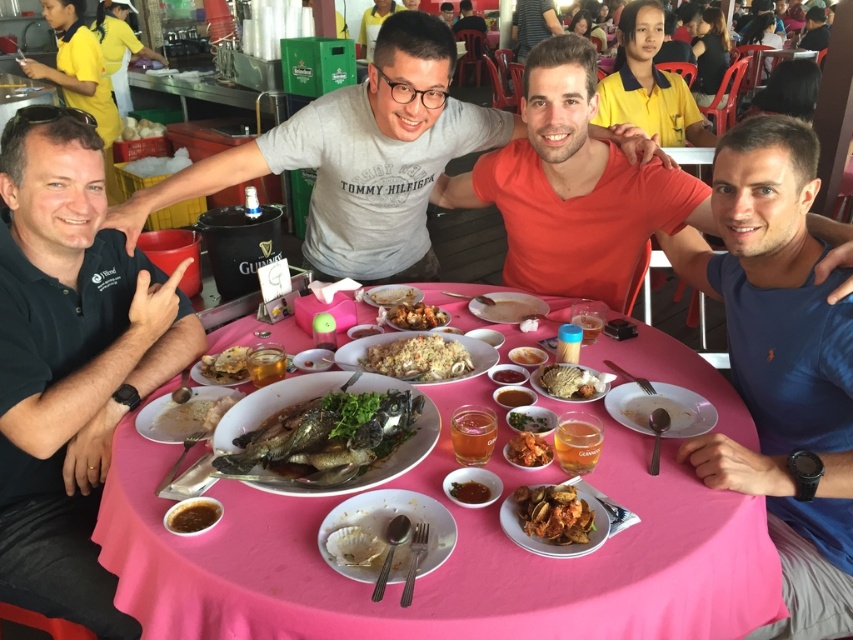
Can you confirm if gray cotton shirt at upper center is smaller than shiny orange shrimp at center?

No.

Is gray cotton shirt at upper center to the left of shiny orange shrimp at center from the viewer's perspective?

Yes, gray cotton shirt at upper center is to the left of shiny orange shrimp at center.

Find the location of `gray cotton shirt at upper center`. gray cotton shirt at upper center is located at coordinates click(357, 157).

Identify the location of gray cotton shirt at upper center. click(x=357, y=157).

Which is in front, point (306, 481) or point (393, 316)?

Point (306, 481)

Between green glazed fish at center and brown matte fried chicken at center, which one appears on the right side from the viewer's perspective?

brown matte fried chicken at center is more to the right.

Who is more distant from viewer, (252, 458) or (434, 316)?

Positioned behind is point (434, 316).

The width and height of the screenshot is (853, 640). In order to click on green glazed fish at center in this screenshot , I will do `click(323, 436)`.

Does gray cotton shirt at upper center have a greater height compared to brown matte fried chicken at center?

Correct, gray cotton shirt at upper center is much taller as brown matte fried chicken at center.

Who is more forward, (347, 164) or (432, 307)?

Point (432, 307) is in front.

Is point (383, 243) more distant than point (392, 324)?

Yes, point (383, 243) is behind point (392, 324).

Find the location of a particular element. gray cotton shirt at upper center is located at coordinates (357, 157).